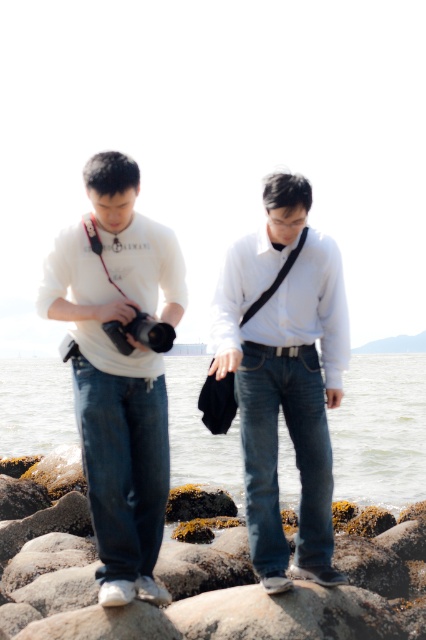
You are a photographer trying to capture the scene from the rocky shoreline. You notice the white matte shirt at center located at point (x=284, y=374). If you want to avoid including this shirt in your photo, which direction should you move your camera to frame the shot differently?

To avoid including the white matte shirt at center located at point (x=284, y=374), you should move your camera away from the center towards the edges or adjust the angle so that the shirt is no longer within the frame.

You are a photographer positioned at the point closest to the camera. Which of the two points, point (178, 428) or point (164, 346), is farther away from your current position?

Point (178, 428) is behind point (164, 346), so it is farther away from your current position.

You are a photographer who needs to adjust the focus of your camera. You are standing next to the white matte shirt at left. Can you reach the camera to adjust the focus without moving your feet?

The distance between the white matte shirt at left and the camera is 4.50 meters, so you cannot reach the camera to adjust the focus without moving your feet since 4.50 meters is too far for an average person to reach.